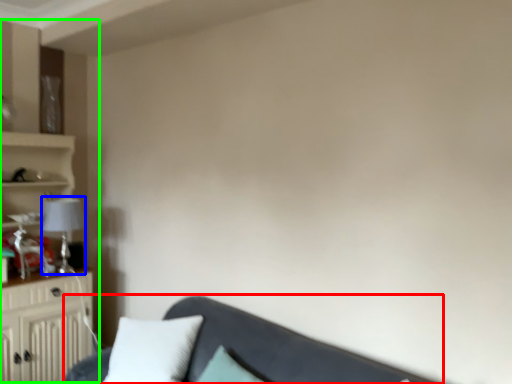
Question: Based on their relative distances, which object is nearer to studio couch (highlighted by a red box)? Choose from lamp (highlighted by a blue box) and entertainment center (highlighted by a green box).

Choices:
 (A) lamp
 (B) entertainment center

Answer: (A)